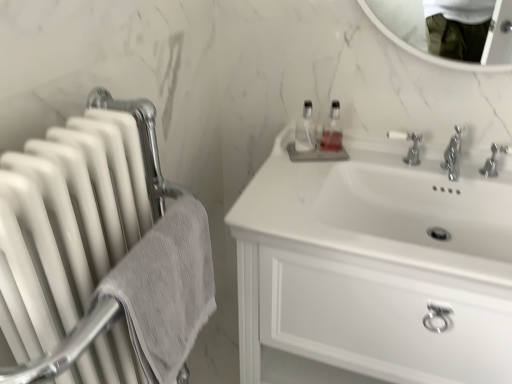
The width and height of the screenshot is (512, 384). I want to click on free space in front of clear glass bottle at center, so click(x=287, y=173).